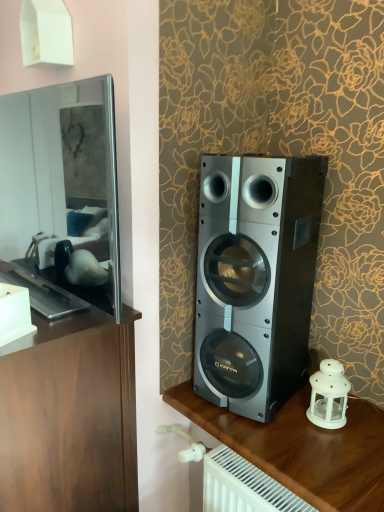
Describe the element at coordinates (255, 278) in the screenshot. This screenshot has height=512, width=384. I see `silver metallic speaker at center` at that location.

At what (x,y) coordinates should I click in order to perform the action: click on matte black mirror at left. Please return your answer as a coordinate pair (x, y). Looking at the image, I should click on (63, 187).

Considering the relative sizes of wooden cabinet at left, the 1th furniture viewed from the left, and matte black mirror at left in the image provided, is wooden cabinet at left, the 1th furniture viewed from the left, bigger than matte black mirror at left?

Correct, wooden cabinet at left, the 1th furniture viewed from the left, is larger in size than matte black mirror at left.

Does wooden cabinet at left, placed as the 2th furniture when sorted from right to left, touch matte black mirror at left?

No, wooden cabinet at left, placed as the 2th furniture when sorted from right to left, is not with matte black mirror at left.

Which object is more forward, wooden cabinet at left, placed as the 2th furniture when sorted from right to left, or matte black mirror at left?

matte black mirror at left is closer to the camera.

Is point (25, 495) more distant than point (43, 247)?

No, (25, 495) is in front of (43, 247).

Which is in front, point (257, 426) or point (328, 417)?

The point (257, 426) is in front.

Where is `candle holder above the metallic silver speaker at right, acting as the first furniture starting from the right (from the image's perspective)`? This screenshot has height=512, width=384. candle holder above the metallic silver speaker at right, acting as the first furniture starting from the right (from the image's perspective) is located at coordinates (328, 395).

Is metallic silver speaker at right, acting as the first furniture starting from the right, looking in the opposite direction of white matte lantern at lower right?

That's not correct — metallic silver speaker at right, acting as the first furniture starting from the right, is not looking away from white matte lantern at lower right.

Which object is thinner, metallic silver speaker at right, marked as the 2th furniture in a left-to-right arrangement, or white matte lantern at lower right?

white matte lantern at lower right is thinner.

Where is `furniture to the right of silver metallic speaker at center`? furniture to the right of silver metallic speaker at center is located at coordinates (302, 448).

From a real-world perspective, is metallic silver speaker at right, acting as the first furniture starting from the right, over silver metallic speaker at center?

No, from a real-world perspective, metallic silver speaker at right, acting as the first furniture starting from the right, is not over silver metallic speaker at center

Which object is positioned more to the left, metallic silver speaker at right, acting as the first furniture starting from the right, or silver metallic speaker at center?

silver metallic speaker at center.

What's the angular difference between metallic silver speaker at right, acting as the first furniture starting from the right, and silver metallic speaker at center's facing directions?

They differ by 10.2 degrees in their facing directions.

Between metallic silver speaker at right, marked as the 2th furniture in a left-to-right arrangement, and wooden cabinet at left, placed as the 2th furniture when sorted from right to left, which one has smaller width?

wooden cabinet at left, placed as the 2th furniture when sorted from right to left.

From a real-world perspective, is metallic silver speaker at right, marked as the 2th furniture in a left-to-right arrangement, over wooden cabinet at left, the 1th furniture viewed from the left?

No, from a real-world perspective, metallic silver speaker at right, marked as the 2th furniture in a left-to-right arrangement, is not over wooden cabinet at left, the 1th furniture viewed from the left

How distant is metallic silver speaker at right, marked as the 2th furniture in a left-to-right arrangement, from wooden cabinet at left, placed as the 2th furniture when sorted from right to left?

metallic silver speaker at right, marked as the 2th furniture in a left-to-right arrangement, is 17.58 inches away from wooden cabinet at left, placed as the 2th furniture when sorted from right to left.

Between point (328, 397) and point (55, 136), which one is positioned in front?

The point (55, 136) is closer to the camera.

From a real-world perspective, is white matte lantern at lower right on matte black mirror at left?

No, from a real-world perspective, white matte lantern at lower right is not over matte black mirror at left

Is matte black mirror at left a part of white matte lantern at lower right?

No, matte black mirror at left is not surrounded by white matte lantern at lower right.

Is silver metallic speaker at center at the right side of wooden cabinet at left, the 1th furniture viewed from the left?

Yes, silver metallic speaker at center is to the right of wooden cabinet at left, the 1th furniture viewed from the left.

Consider the image. How many degrees apart are the facing directions of silver metallic speaker at center and wooden cabinet at left, the 1th furniture viewed from the left?

9.3 degrees.

The width and height of the screenshot is (384, 512). Find the location of `home appliance on the right of wooden cabinet at left, placed as the 2th furniture when sorted from right to left`. home appliance on the right of wooden cabinet at left, placed as the 2th furniture when sorted from right to left is located at coordinates coord(255,278).

Is silver metallic speaker at center thinner than wooden cabinet at left, the 1th furniture viewed from the left?

Yes, silver metallic speaker at center is thinner than wooden cabinet at left, the 1th furniture viewed from the left.

Does point (61, 410) come in front of point (337, 503)?

That is False.

Is wooden cabinet at left, the 1th furniture viewed from the left, behind metallic silver speaker at right, acting as the first furniture starting from the right?

No.

Which of these two, wooden cabinet at left, the 1th furniture viewed from the left, or metallic silver speaker at right, marked as the 2th furniture in a left-to-right arrangement, is smaller?

Smaller between the two is metallic silver speaker at right, marked as the 2th furniture in a left-to-right arrangement.

From a real-world perspective, is wooden cabinet at left, placed as the 2th furniture when sorted from right to left, beneath metallic silver speaker at right, acting as the first furniture starting from the right?

No, from a real-world perspective, wooden cabinet at left, placed as the 2th furniture when sorted from right to left, is not below metallic silver speaker at right, acting as the first furniture starting from the right.

This screenshot has height=512, width=384. In order to click on mirror that appears in front of the wooden cabinet at left, placed as the 2th furniture when sorted from right to left in this screenshot , I will do `click(63, 187)`.

Locate an element on the screen. candle holder above the metallic silver speaker at right, acting as the first furniture starting from the right (from the image's perspective) is located at coordinates (328, 395).

Based on their spatial positions, is silver metallic speaker at center or wooden cabinet at left, the 1th furniture viewed from the left, closer to matte black mirror at left?

Among the two, wooden cabinet at left, the 1th furniture viewed from the left, is located nearer to matte black mirror at left.

Estimate the real-world distances between objects in this image. Which object is closer to white matte lantern at lower right, silver metallic speaker at center or metallic silver speaker at right, acting as the first furniture starting from the right?

The object closer to white matte lantern at lower right is metallic silver speaker at right, acting as the first furniture starting from the right.

From the image, which object appears to be nearer to silver metallic speaker at center, wooden cabinet at left, placed as the 2th furniture when sorted from right to left, or matte black mirror at left?

wooden cabinet at left, placed as the 2th furniture when sorted from right to left, is positioned closer to the anchor silver metallic speaker at center.

Which object lies further to the anchor point wooden cabinet at left, the 1th furniture viewed from the left, white matte lantern at lower right or metallic silver speaker at right, acting as the first furniture starting from the right?

white matte lantern at lower right.

Based on their spatial positions, is silver metallic speaker at center or white matte lantern at lower right closer to metallic silver speaker at right, marked as the 2th furniture in a left-to-right arrangement?

Based on the image, white matte lantern at lower right appears to be nearer to metallic silver speaker at right, marked as the 2th furniture in a left-to-right arrangement.

Considering their positions, is matte black mirror at left positioned further to metallic silver speaker at right, marked as the 2th furniture in a left-to-right arrangement, than white matte lantern at lower right?

Based on the image, matte black mirror at left appears to be further to metallic silver speaker at right, marked as the 2th furniture in a left-to-right arrangement.

Based on their spatial positions, is white matte lantern at lower right or wooden cabinet at left, the 1th furniture viewed from the left, further from silver metallic speaker at center?

wooden cabinet at left, the 1th furniture viewed from the left.

Looking at this image, from the image, which object appears to be nearer to metallic silver speaker at right, acting as the first furniture starting from the right, silver metallic speaker at center or wooden cabinet at left, placed as the 2th furniture when sorted from right to left?

Based on the image, silver metallic speaker at center appears to be nearer to metallic silver speaker at right, acting as the first furniture starting from the right.

Find the location of a particular element. The image size is (384, 512). home appliance between matte black mirror at left and wooden cabinet at left, the 1th furniture viewed from the left, in the up-down direction is located at coordinates (255, 278).

I want to click on furniture located between wooden cabinet at left, placed as the 2th furniture when sorted from right to left, and white matte lantern at lower right in the left-right direction, so click(x=302, y=448).

You are a GUI agent. You are given a task and a screenshot of the screen. Output one action in this format:
    pyautogui.click(x=<x>, y=<y>)
    Task: Click on the candle holder between silver metallic speaker at center and metallic silver speaker at right, marked as the 2th furniture in a left-to-right arrangement, in the vertical direction
    This screenshot has width=384, height=512.
    Given the screenshot: What is the action you would take?
    pyautogui.click(x=328, y=395)

Where is `candle holder between matte black mirror at left and metallic silver speaker at right, marked as the 2th furniture in a left-to-right arrangement, in the vertical direction`? candle holder between matte black mirror at left and metallic silver speaker at right, marked as the 2th furniture in a left-to-right arrangement, in the vertical direction is located at coordinates (328, 395).